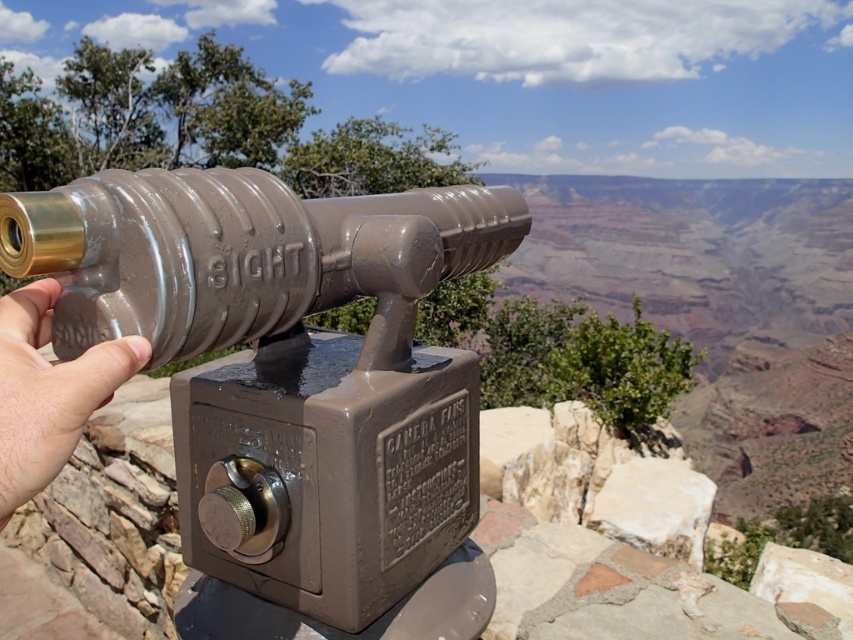
Question: Which point is closer to the camera?

Choices:
 (A) (462, 362)
 (B) (47, 390)

Answer: (B)

Question: Among these points, which one is nearest to the camera?

Choices:
 (A) (51, 428)
 (B) (370, 412)

Answer: (A)

Question: Does matte brown telescope at center appear over pale skin at center?

Choices:
 (A) no
 (B) yes

Answer: (A)

Question: Can you confirm if matte brown telescope at center is wider than pale skin at center?

Choices:
 (A) yes
 (B) no

Answer: (A)

Question: Which point appears farthest from the camera in this image?

Choices:
 (A) (4, 442)
 (B) (447, 490)

Answer: (B)

Question: Considering the relative positions of matte brown telescope at center and pale skin at center in the image provided, where is matte brown telescope at center located with respect to pale skin at center?

Choices:
 (A) left
 (B) right

Answer: (B)